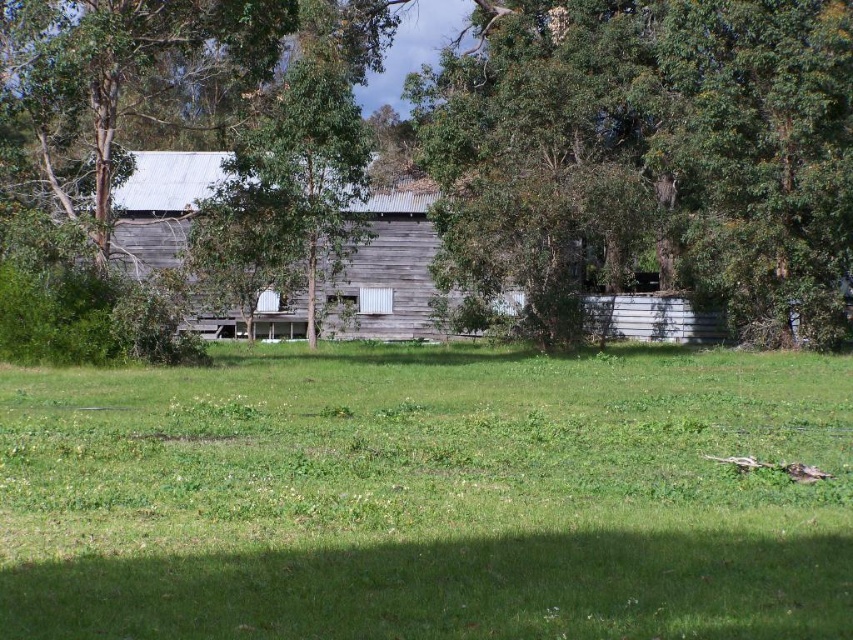
Question: Does green leafy tree at center have a smaller size compared to weathered wood barn at center?

Choices:
 (A) yes
 (B) no

Answer: (A)

Question: Considering the relative positions of green leafy tree at center and weathered wood barn at center in the image provided, where is green leafy tree at center located with respect to weathered wood barn at center?

Choices:
 (A) below
 (B) above

Answer: (B)

Question: Is green grass at center to the left of weathered wood barn at center from the viewer's perspective?

Choices:
 (A) yes
 (B) no

Answer: (B)

Question: Which point appears farthest from the camera in this image?

Choices:
 (A) (213, 353)
 (B) (728, 84)

Answer: (A)

Question: Which is nearer to the green grass at center?

Choices:
 (A) weathered wood barn at center
 (B) green leafy tree at center

Answer: (B)

Question: Which point is farther from the camera taking this photo?

Choices:
 (A) (666, 600)
 (B) (215, 164)
 (C) (799, 269)

Answer: (B)